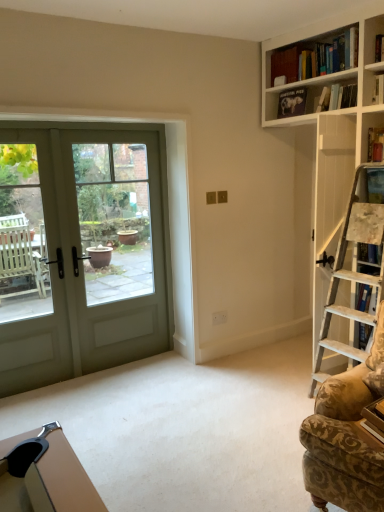
Measure the distance between point (373, 140) and camera.

The distance of point (373, 140) from camera is 9.10 feet.

The image size is (384, 512). What do you see at coordinates (35, 264) in the screenshot?
I see `green matte screen door at left` at bounding box center [35, 264].

The image size is (384, 512). Find the location of `green matte door at left`. green matte door at left is located at coordinates (83, 249).

Could you tell me if green matte screen door at left is turned towards patterned fabric rocking chair at right?

No, green matte screen door at left is not aimed at patterned fabric rocking chair at right.

Consider the image. Who is smaller, green matte screen door at left or patterned fabric rocking chair at right?

green matte screen door at left is smaller.

Considering their positions, is green matte screen door at left located in front of or behind patterned fabric rocking chair at right?

Clearly, green matte screen door at left is behind patterned fabric rocking chair at right.

Which object is positioned more to the left, green matte screen door at left or green matte door at left?

green matte screen door at left.

Is green matte screen door at left oriented towards green matte door at left?

Yes.

Image resolution: width=384 pixels, height=512 pixels. In order to click on screen door in front of the green matte door at left in this screenshot , I will do `click(35, 264)`.

Which object is positioned more to the right, hardcover book at upper right, the 1th book positioned from the front, or patterned fabric rocking chair at right?

hardcover book at upper right, the 1th book positioned from the front, is more to the right.

Between hardcover book at upper right, which appears as the first book when viewed from the right, and patterned fabric rocking chair at right, which one has more height?

With more height is patterned fabric rocking chair at right.

From a real-world perspective, is hardcover book at upper right, acting as the 2th book starting from the left, on patterned fabric rocking chair at right?

Yes.

Does matte black book at upper center, which is the 1th book in top-to-bottom order, have a greater height compared to patterned fabric rocking chair at right?

In fact, matte black book at upper center, which is the 1th book in top-to-bottom order, may be shorter than patterned fabric rocking chair at right.

Is matte black book at upper center, which is the 1th book from left to right, turned away from patterned fabric rocking chair at right?

That's not correct — matte black book at upper center, which is the 1th book from left to right, is not looking away from patterned fabric rocking chair at right.

Relative to patterned fabric rocking chair at right, is matte black book at upper center, which is the 1th book from left to right, in front or behind?

matte black book at upper center, which is the 1th book from left to right, is positioned farther from the viewer than patterned fabric rocking chair at right.

Identify the location of door below the matte black book at upper center, which is the 1th book from left to right (from the image's perspective). (83, 249).

Considering the points (48, 240) and (283, 103), which point is behind, point (48, 240) or point (283, 103)?

Point (283, 103)

Does green matte door at left lie in front of matte black book at upper center, which is the 1th book in top-to-bottom order?

Yes, green matte door at left is closer to the viewer.

From a real-world perspective, is matte black book at upper center, the second book in the right-to-left sequence, physically below green matte door at left?

No.

Does matte black book at upper center, the 2th book from the bottom, have a lesser height compared to green matte door at left?

Indeed, matte black book at upper center, the 2th book from the bottom, has a lesser height compared to green matte door at left.

How far apart are matte black book at upper center, which is the 1th book from left to right, and green matte door at left?

They are 1.82 meters apart.

Is point (287, 106) closer or farther from the camera than point (101, 351)?

Point (287, 106).

Are green matte screen door at left and hardcover book at upper right, the 2th book when ordered from top to bottom, located far from each other?

Yes, green matte screen door at left and hardcover book at upper right, the 2th book when ordered from top to bottom, are located far from each other.

Is green matte screen door at left facing towards hardcover book at upper right, which appears as the first book when viewed from the right?

No, green matte screen door at left is not aimed at hardcover book at upper right, which appears as the first book when viewed from the right.

Is point (10, 298) farther from camera compared to point (371, 159)?

Yes, point (10, 298) is behind point (371, 159).

From a real-world perspective, between green matte screen door at left and hardcover book at upper right, the 2th book when ordered from top to bottom, who is vertically lower?

From a 3D spatial view, green matte screen door at left is below.

Locate an element on the screen. screen door on the left of patterned fabric rocking chair at right is located at coordinates (35, 264).

I want to click on door located above the green matte screen door at left (from a real-world perspective), so click(x=83, y=249).

Considering their positions, is green matte screen door at left positioned closer to green matte door at left than matte black book at upper center, which appears as the 1th book when viewed from the back?

green matte screen door at left lies closer to green matte door at left than the other object.

Based on their spatial positions, is hardcover book at upper right, which ranks as the first book in bottom-to-top order, or patterned fabric rocking chair at right closer to green matte door at left?

patterned fabric rocking chair at right.

Considering their positions, is green matte door at left positioned further to green matte screen door at left than matte black book at upper center, which is the 1th book from left to right?

The object further to green matte screen door at left is matte black book at upper center, which is the 1th book from left to right.

Looking at the image, which one is located further to green matte door at left, patterned fabric rocking chair at right or green matte screen door at left?

patterned fabric rocking chair at right is further to green matte door at left.

Estimate the real-world distances between objects in this image. Which object is further from green matte screen door at left, green matte door at left or hardcover book at upper right, marked as the second book in a back-to-front arrangement?

The object further to green matte screen door at left is hardcover book at upper right, marked as the second book in a back-to-front arrangement.

Based on their spatial positions, is green matte door at left or hardcover book at upper right, the 1th book positioned from the front, further from patterned fabric rocking chair at right?

green matte door at left is further to patterned fabric rocking chair at right.

Which object lies further to the anchor point hardcover book at upper right, the 2th book when ordered from top to bottom, green matte screen door at left or matte black book at upper center, the second book in the right-to-left sequence?

The object further to hardcover book at upper right, the 2th book when ordered from top to bottom, is green matte screen door at left.

Considering their positions, is hardcover book at upper right, marked as the second book in a back-to-front arrangement, positioned closer to patterned fabric rocking chair at right than green matte door at left?

hardcover book at upper right, marked as the second book in a back-to-front arrangement.

Identify the location of rocking chair between green matte door at left and hardcover book at upper right, acting as the 2th book starting from the left, from left to right. The height and width of the screenshot is (512, 384). (347, 437).

Find the location of a particular element. door between green matte screen door at left and hardcover book at upper right, which appears as the first book when viewed from the right is located at coordinates (83, 249).

This screenshot has width=384, height=512. What are the coordinates of `book between matte black book at upper center, which is the 1th book from left to right, and patterned fabric rocking chair at right vertically` in the screenshot? It's located at (375, 144).

This screenshot has height=512, width=384. In order to click on book between green matte door at left and patterned fabric rocking chair at right in the horizontal direction in this screenshot , I will do `click(292, 102)`.